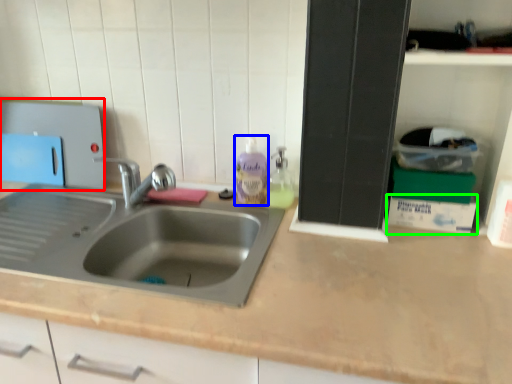
Question: Estimate the real-world distances between objects in this image. Which object is closer to appliance (highlighted by a red box), cleaning product (highlighted by a blue box) or box (highlighted by a green box)?

Choices:
 (A) cleaning product
 (B) box

Answer: (A)